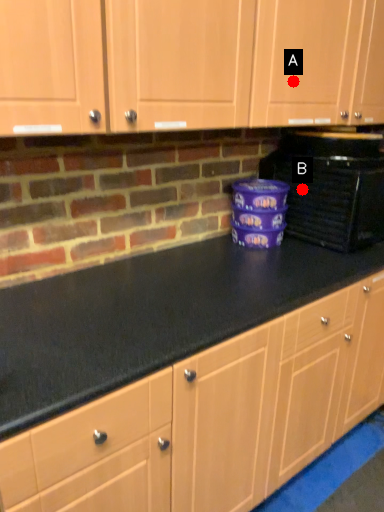
Question: Two points are circled on the image, labeled by A and B beside each circle. Among these points, which one is nearest to the camera?

Choices:
 (A) A is closer
 (B) B is closer

Answer: (A)